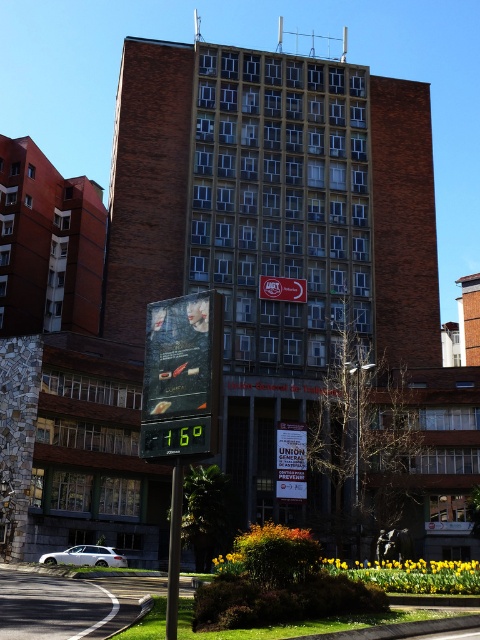
Question: Does green digital display at center appear on the right side of black metal pole at lower center?

Choices:
 (A) yes
 (B) no

Answer: (B)

Question: Which object appears closest to the camera in this image?

Choices:
 (A) black metal pole at lower center
 (B) green digital display at center

Answer: (B)

Question: Does green digital display at center have a smaller size compared to black metal pole at lower center?

Choices:
 (A) no
 (B) yes

Answer: (A)

Question: Can you confirm if green digital display at center is smaller than black metal pole at lower center?

Choices:
 (A) yes
 (B) no

Answer: (B)